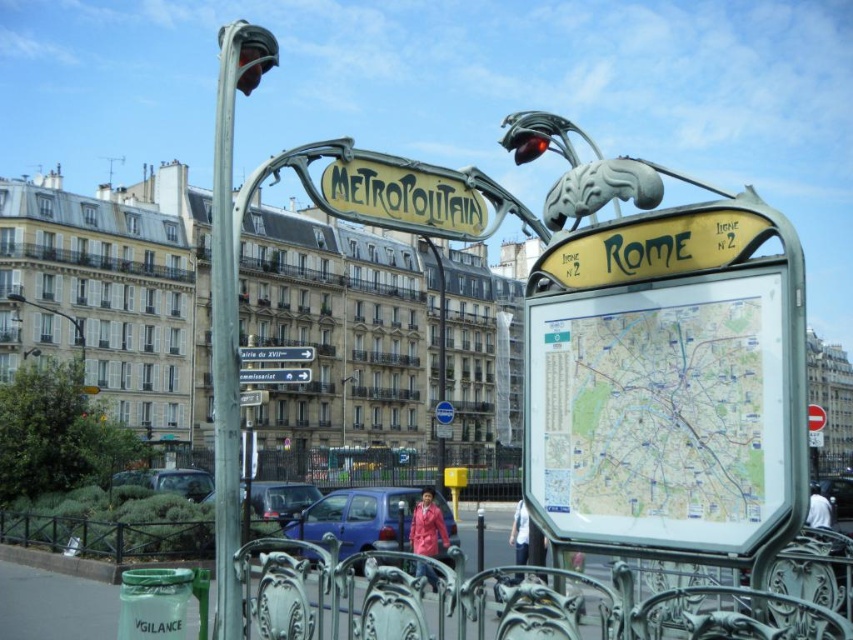
Which is more to the left, metallic pole at left or metallic sign at center?

From the viewer's perspective, metallic pole at left appears more on the left side.

Between metallic pole at left and metallic sign at center, which one is positioned lower?

metallic sign at center

Where is `metallic pole at left`? Image resolution: width=853 pixels, height=640 pixels. metallic pole at left is located at coordinates (229, 307).

Which is more to the left, paper map at center or brushed metal streetlight at upper left?

brushed metal streetlight at upper left

Locate an element on the screen. The width and height of the screenshot is (853, 640). paper map at center is located at coordinates (660, 412).

Does metallic wrought iron fence at center have a greater width compared to metallic yellow sign at center?

Indeed, metallic wrought iron fence at center has a greater width compared to metallic yellow sign at center.

Where is `metallic wrought iron fence at center`? The height and width of the screenshot is (640, 853). metallic wrought iron fence at center is located at coordinates (54, 595).

Identify the location of metallic wrought iron fence at center. (54, 595).